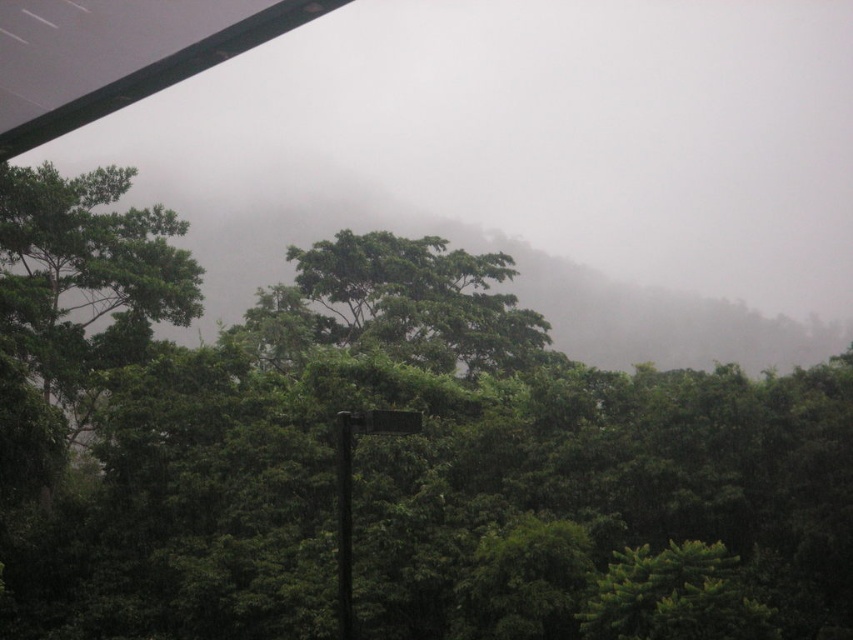
Between point (426, 278) and point (350, 412), which one is positioned in front?

Point (350, 412)

Measure the distance between green leafy tree at center and wooden sign at center.

104.67 feet

At what (x,y) coordinates should I click in order to perform the action: click on green leafy tree at center. Please return your answer as a coordinate pair (x, y). This screenshot has width=853, height=640. Looking at the image, I should click on (421, 300).

Is point (341, 468) closer to camera compared to point (347, 461)?

No.

Between wooden sign at center and green matte pole at center, which one appears on the left side from the viewer's perspective?

green matte pole at center is more to the left.

Does point (376, 413) come farther from viewer compared to point (351, 417)?

No, it is in front of (351, 417).

Identify the location of wooden sign at center. This screenshot has height=640, width=853. (351, 490).

Who is shorter, green leafy tree at center or green matte pole at center?

green matte pole at center

Does green leafy tree at center have a lesser height compared to green matte pole at center?

Incorrect, green leafy tree at center's height does not fall short of green matte pole at center's.

This screenshot has width=853, height=640. What do you see at coordinates (421, 300) in the screenshot?
I see `green leafy tree at center` at bounding box center [421, 300].

You are a GUI agent. You are given a task and a screenshot of the screen. Output one action in this format:
    pyautogui.click(x=<x>, y=<y>)
    Task: Click on the green leafy tree at center
    The height and width of the screenshot is (640, 853).
    Given the screenshot: What is the action you would take?
    pos(421,300)